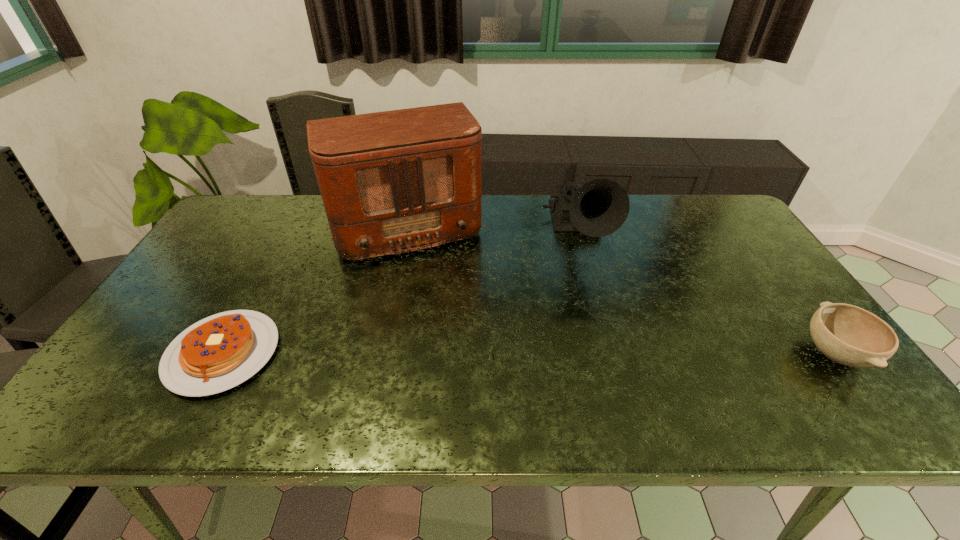
Locate an element on the screen. Image resolution: width=960 pixels, height=540 pixels. vacant space on the desktop that is between the pancake and the rightmost object and is positioned from the horn of the second object from right to left is located at coordinates (608, 353).

Where is `free space on the desktop that is between the shortest object and the second shortest object and is positioned on the front panel of the radio receiver`? free space on the desktop that is between the shortest object and the second shortest object and is positioned on the front panel of the radio receiver is located at coordinates (443, 353).